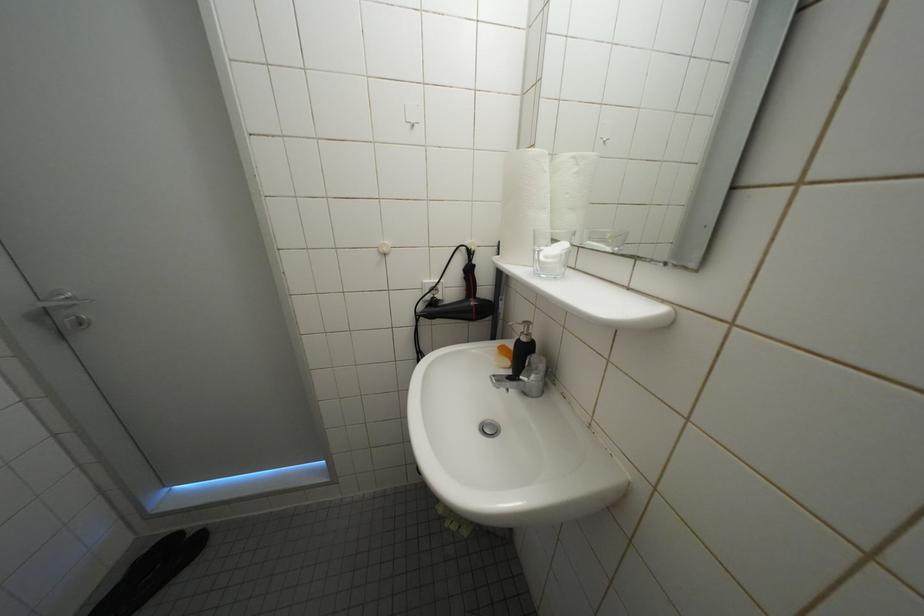
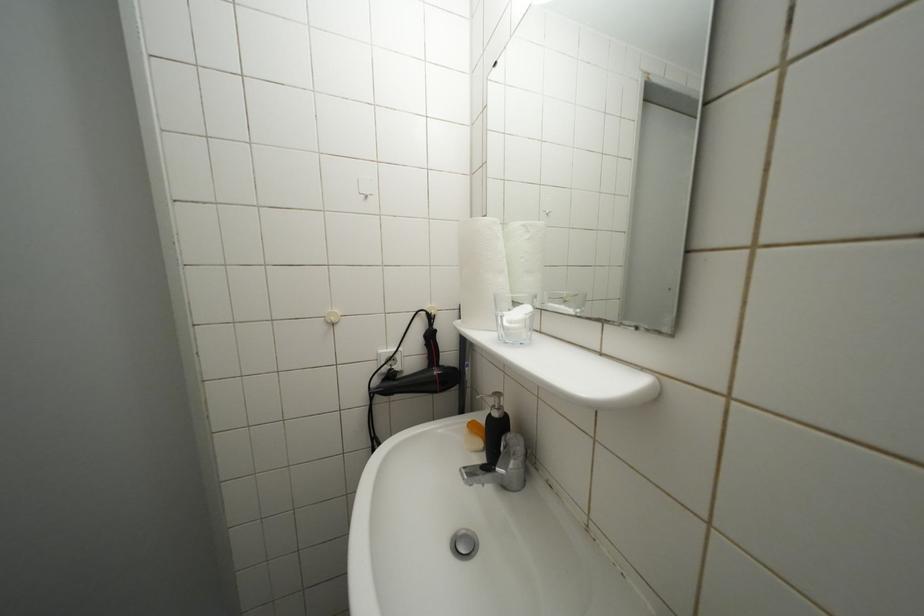
Question: The first image is from the beginning of the video and the second image is from the end. How did the camera likely rotate when shooting the video?

Choices:
 (A) Left
 (B) Right
 (C) Up
 (D) Down

Answer: (C)